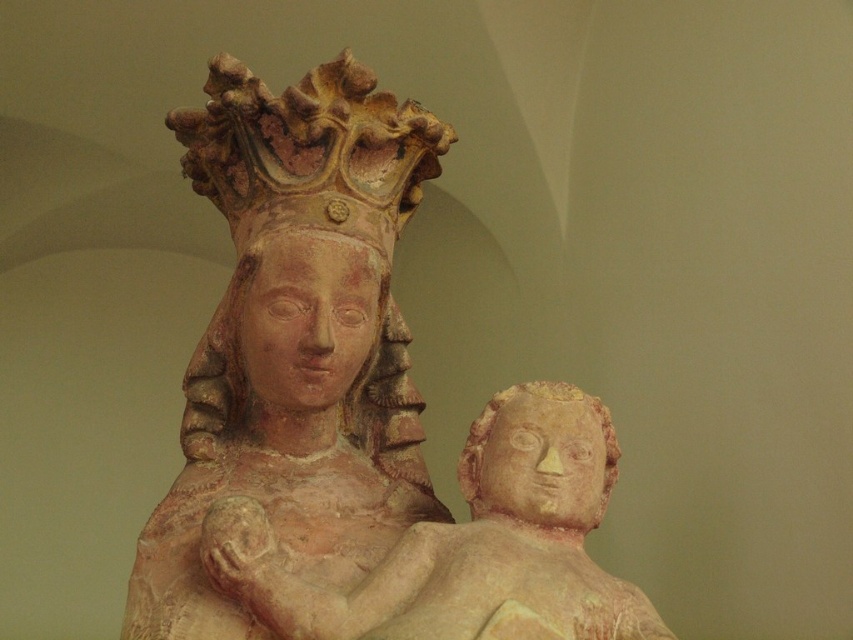
Based on the photo, which is more to the left, matte terracotta head at center or matte stone head at center?

matte terracotta head at center is more to the left.

Who is more forward, (323, 337) or (476, 419)?

Positioned in front is point (323, 337).

Find the location of `matte terracotta head at center`. matte terracotta head at center is located at coordinates (x=305, y=317).

Does matte terracotta statue at center have a greater height compared to matte terracotta head at center?

Yes.

Measure the distance between point (318, 129) and camera.

Point (318, 129) is 1.63 meters away from camera.

Describe the element at coordinates (354, 412) in the screenshot. I see `matte terracotta statue at center` at that location.

Locate an element on the screen. This screenshot has height=640, width=853. matte terracotta statue at center is located at coordinates (354, 412).

Is matte terracotta statue at center wider than matte stone head at center?

Correct, the width of matte terracotta statue at center exceeds that of matte stone head at center.

In the scene shown: Between matte terracotta statue at center and matte stone head at center, which one appears on the left side from the viewer's perspective?

matte terracotta statue at center is more to the left.

This screenshot has height=640, width=853. Describe the element at coordinates (354, 412) in the screenshot. I see `matte terracotta statue at center` at that location.

This screenshot has width=853, height=640. In order to click on matte terracotta statue at center in this screenshot , I will do `click(354, 412)`.